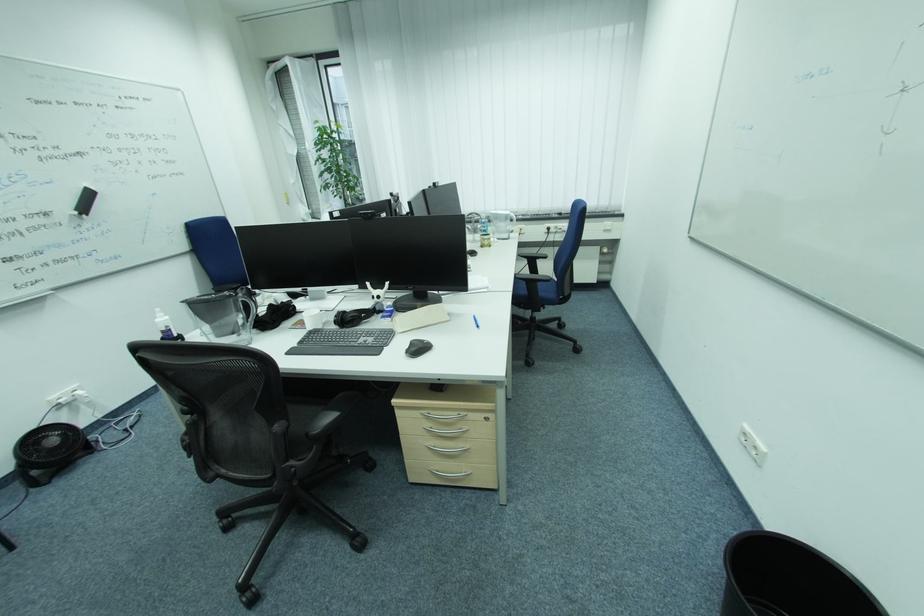
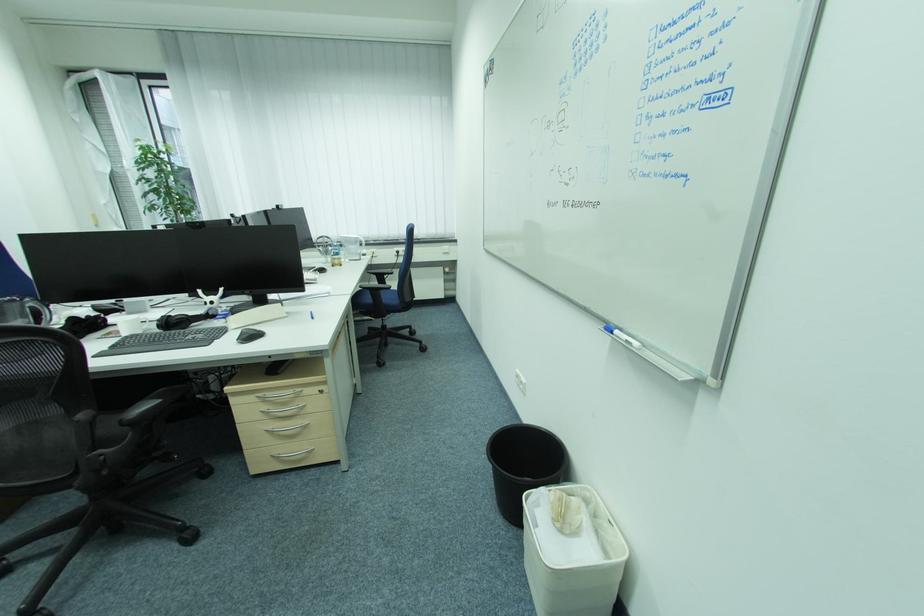
Where in the second image is the point corresponding to [464,414] from the first image?

(299, 392)